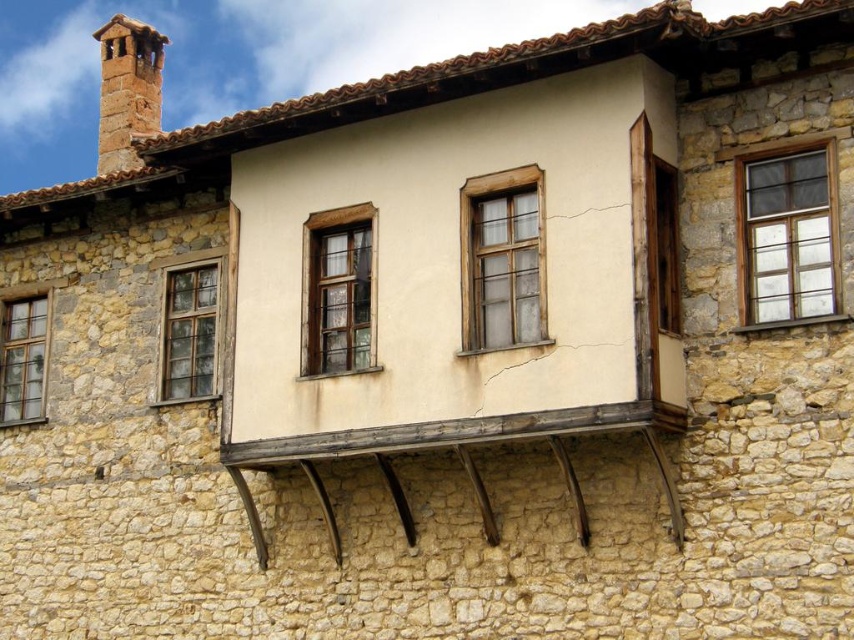
Question: Is the position of clear glass window at upper right more distant than that of wooden window at center?

Choices:
 (A) no
 (B) yes

Answer: (A)

Question: Is clear glass window at upper right wider than translucent glass window at left?

Choices:
 (A) yes
 (B) no

Answer: (A)

Question: Which is farther from the clear glass window at left?

Choices:
 (A) rustic stone chimney at upper left
 (B) wooden window at center

Answer: (A)

Question: Among these objects, which one is farthest from the camera?

Choices:
 (A) translucent glass window at center
 (B) clear glass window at left
 (C) wooden window at center

Answer: (B)

Question: Can you confirm if wooden window at center is positioned above translucent glass window at left?

Choices:
 (A) yes
 (B) no

Answer: (A)

Question: Which point is closer to the camera?

Choices:
 (A) 165,376
 (B) 542,280

Answer: (B)